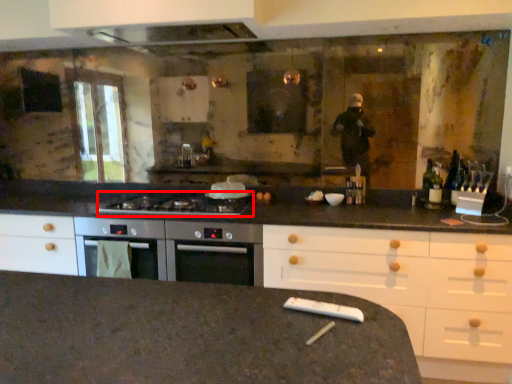
Question: Where is gas stove (annotated by the red box) located in relation to appliance in the image?

Choices:
 (A) right
 (B) left

Answer: (B)